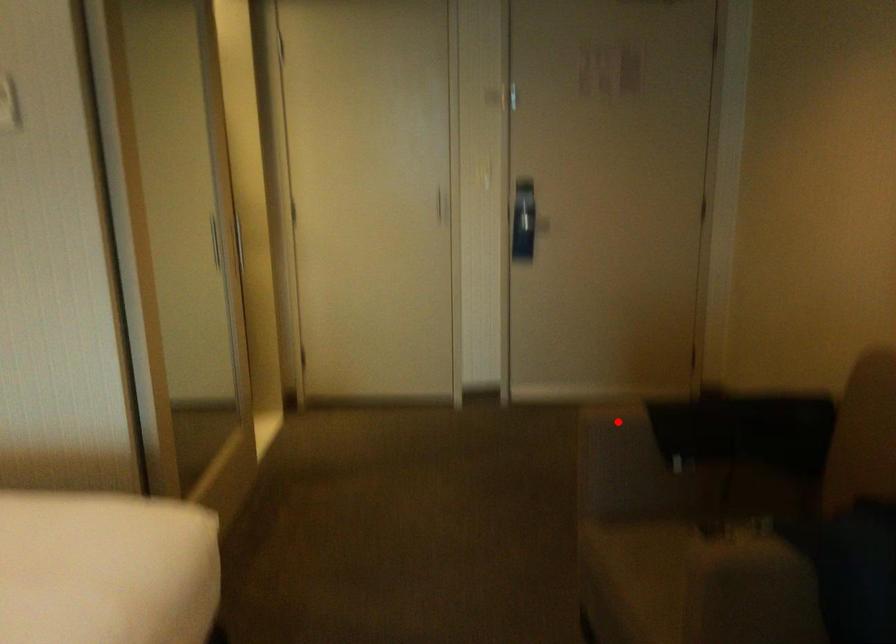
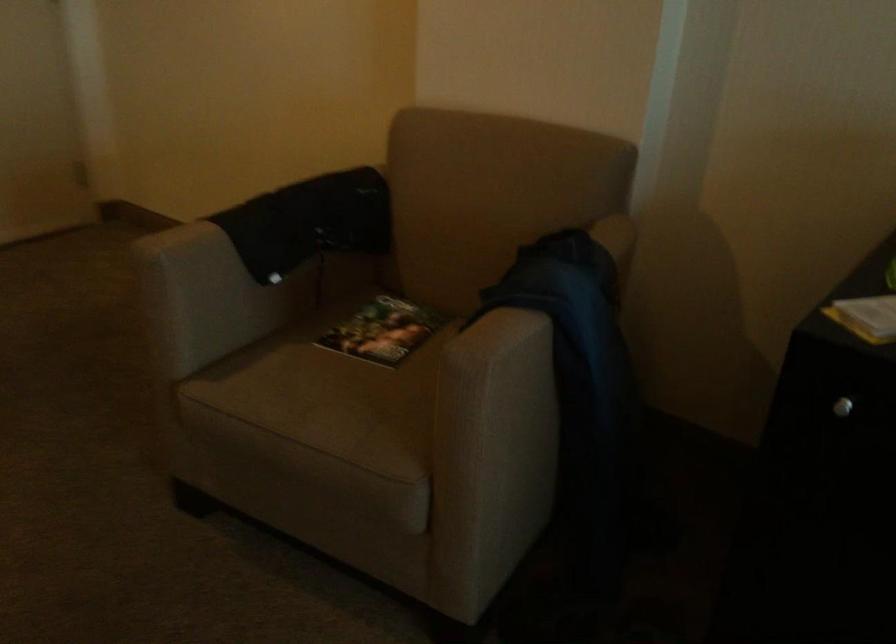
Question: A red point is marked in image1. In image2, is the corresponding 3D point closer to the camera or farther? Reply with the corresponding letter.

Choices:
 (A) The corresponding 3D point is closer.
 (B) The corresponding 3D point is farther.

Answer: (A)